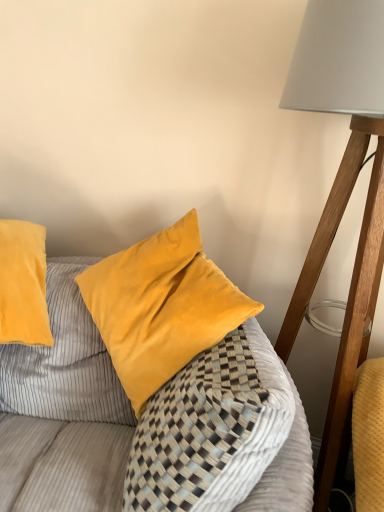
Question: Is matte white lampshade at right facing away from velvet yellow pillow at center?

Choices:
 (A) yes
 (B) no

Answer: (B)

Question: Can you confirm if matte white lampshade at right is taller than velvet yellow pillow at center?

Choices:
 (A) yes
 (B) no

Answer: (A)

Question: Is matte white lampshade at right completely or partially outside of velvet yellow pillow at center?

Choices:
 (A) yes
 (B) no

Answer: (A)

Question: Is matte white lampshade at right next to velvet yellow pillow at center and touching it?

Choices:
 (A) yes
 (B) no

Answer: (B)

Question: Is matte white lampshade at right to the right of velvet yellow pillow at center from the viewer's perspective?

Choices:
 (A) no
 (B) yes

Answer: (B)

Question: Can you confirm if matte white lampshade at right is smaller than velvet yellow pillow at center?

Choices:
 (A) no
 (B) yes

Answer: (A)

Question: From a real-world perspective, is velvet yellow pillow at center beneath matte white lampshade at right?

Choices:
 (A) yes
 (B) no

Answer: (A)

Question: Is velvet yellow pillow at center facing away from matte white lampshade at right?

Choices:
 (A) no
 (B) yes

Answer: (B)

Question: Is velvet yellow pillow at center positioned far away from matte white lampshade at right?

Choices:
 (A) no
 (B) yes

Answer: (A)

Question: From the image's perspective, would you say velvet yellow pillow at center is positioned over matte white lampshade at right?

Choices:
 (A) yes
 (B) no

Answer: (B)

Question: Can you confirm if velvet yellow pillow at center is shorter than matte white lampshade at right?

Choices:
 (A) yes
 (B) no

Answer: (A)

Question: Is velvet yellow pillow at center directly adjacent to matte white lampshade at right?

Choices:
 (A) no
 (B) yes

Answer: (A)

Question: From a real-world perspective, relative to matte white lampshade at right, is velvet yellow pillow at center vertically above or below?

Choices:
 (A) below
 (B) above

Answer: (A)